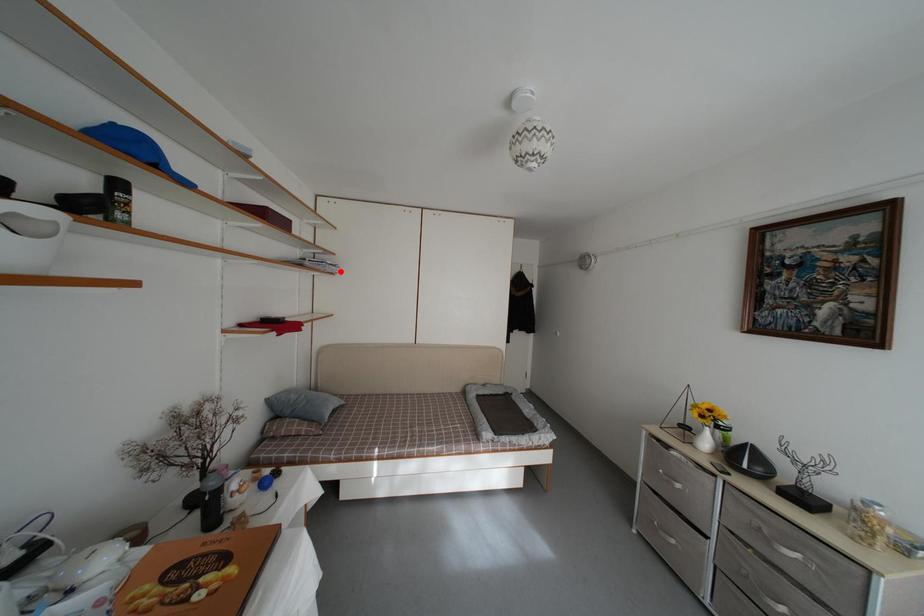
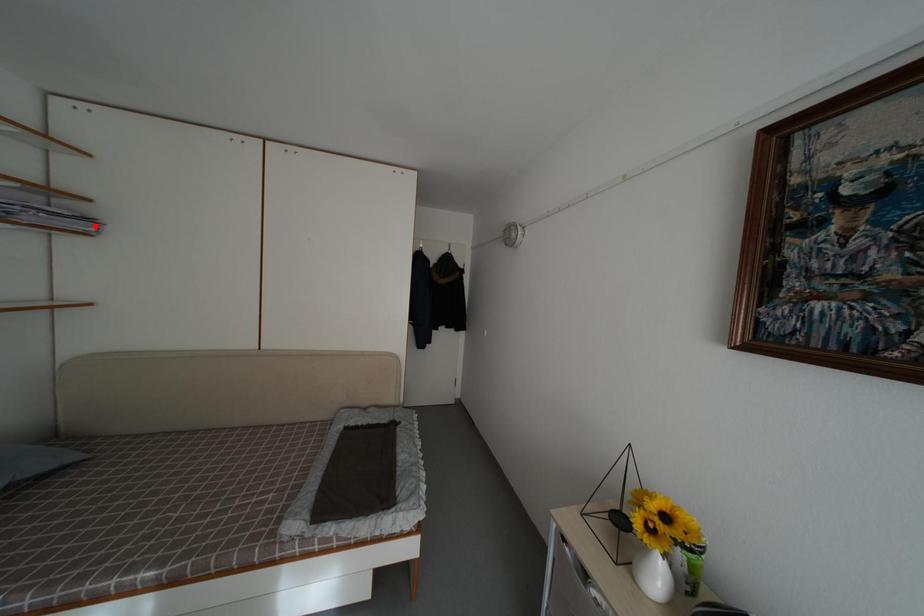
I am providing you with two images of the same scene from different viewpoints. A red point is marked on the first image and another point is marked on the second image. Do the highlighted points in image1 and image2 indicate the same real-world spot?

Yes